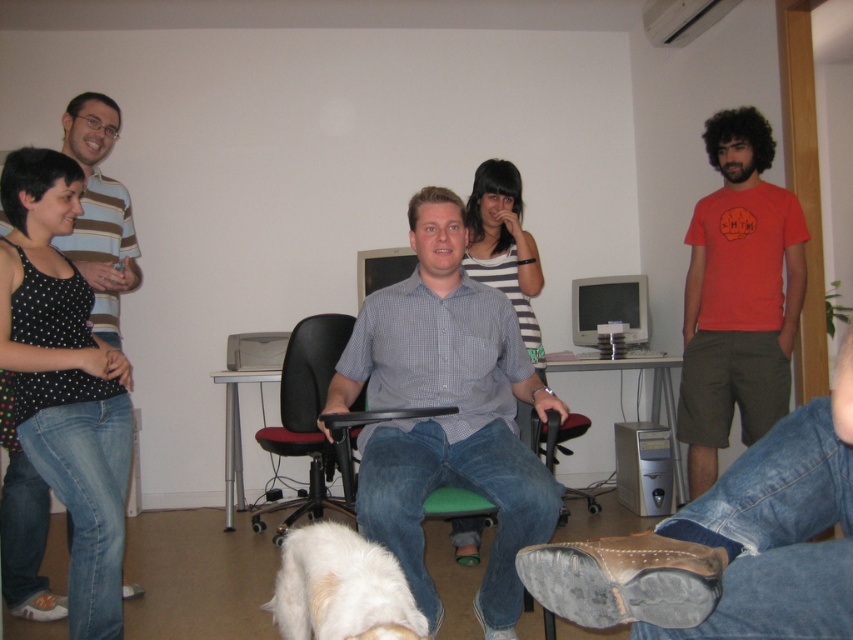
Is checkered shirt at center thinner than orange cotton t-shirt at right?

No.

Is point (502, 381) in front of point (698, 468)?

Yes, point (502, 381) is closer to viewer.

Which is in front, point (511, 630) or point (737, 116)?

Point (511, 630)

The width and height of the screenshot is (853, 640). In order to click on checkered shirt at center in this screenshot , I will do `click(445, 417)`.

Can you confirm if checkered shirt at center is wider than striped fabric dress at center?

Yes.

Can you confirm if checkered shirt at center is positioned below striped fabric dress at center?

Indeed, checkered shirt at center is positioned under striped fabric dress at center.

Locate an element on the screen. The image size is (853, 640). checkered shirt at center is located at coordinates (445, 417).

I want to click on checkered shirt at center, so click(445, 417).

Does orange cotton t-shirt at right have a larger size compared to striped fabric dress at center?

Yes.

Is point (793, 264) closer to camera compared to point (521, 280)?

Yes, point (793, 264) is closer to viewer.

Is point (679, 422) closer to camera compared to point (492, 240)?

Yes.

This screenshot has height=640, width=853. What are the coordinates of `orange cotton t-shirt at right` in the screenshot? It's located at (738, 296).